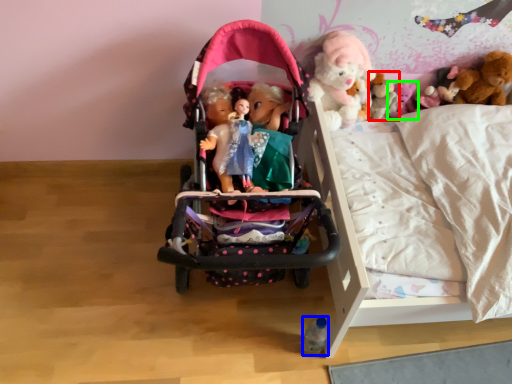
Question: Considering the real-world distances, which object is farthest from doll (highlighted by a red box)? toy (highlighted by a blue box) or toy (highlighted by a green box)?

Choices:
 (A) toy
 (B) toy

Answer: (A)